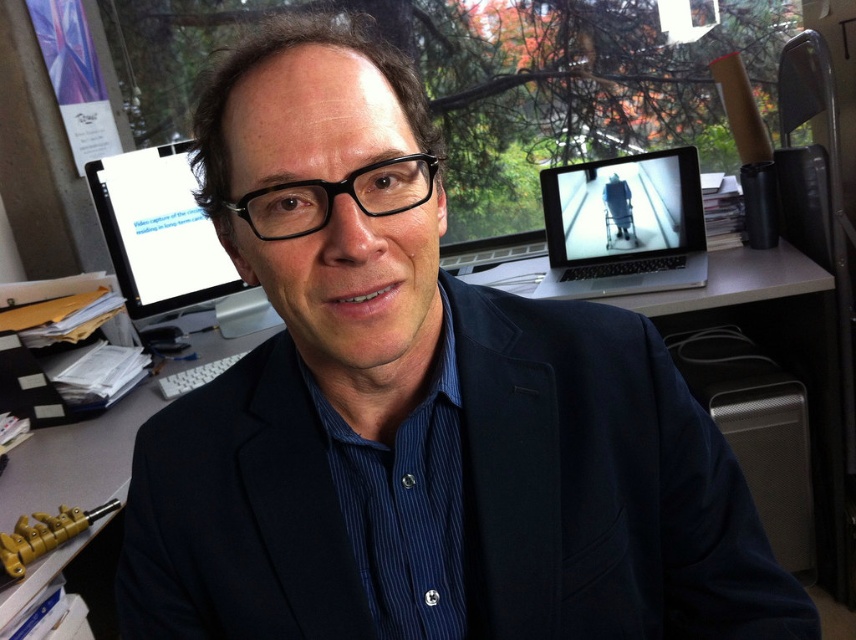
You are standing in an office and want to place a 20 inch monitor on the desk. There is a point at coordinates point (x=444, y=552) where you want to place it. Can you determine if the monitor will fit at that location?

The distance between point (x=444, y=552) and the camera is 21.12 inches, so the 20 inch monitor should fit as there is enough space.

Looking at this image, you are an office worker who needs to determine if your blue striped dress shirt at center can fit into a drawer that is the same width as the matte black monitor at upper left. Can it fit?

The blue striped dress shirt at center has a lesser width compared to the matte black monitor at upper left, so it should fit into the drawer.

You are an office worker who needs to locate the blue striped dress shirt at center and the matte black monitor at upper left. According to the scene, which object is positioned to the right of the other?

The blue striped dress shirt at center is positioned to the right of the matte black monitor at upper left.